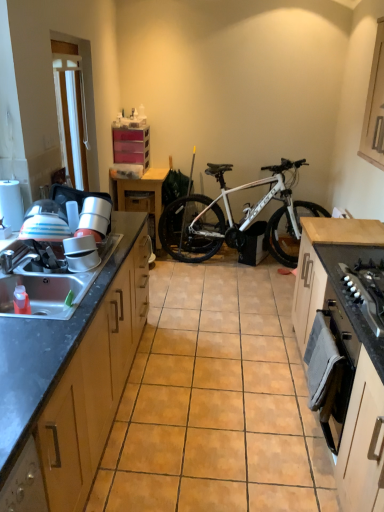
At what (x,y) coordinates should I click in order to perform the action: click on vacant space in front of white metallic bicycle at center. Please return your answer as a coordinate pair (x, y). The image size is (384, 512). Looking at the image, I should click on (238, 300).